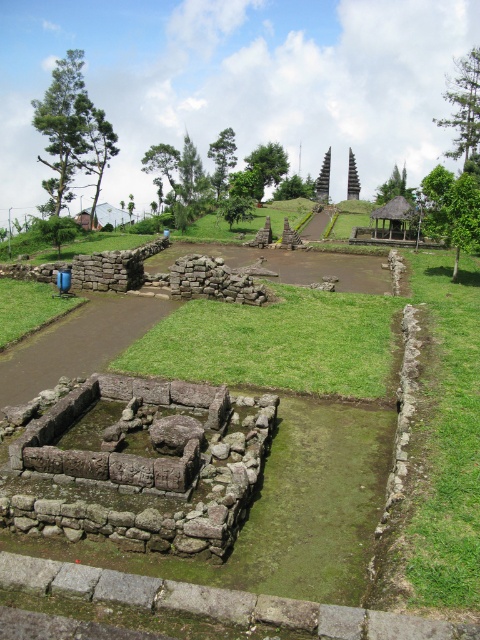
You are an archaeologist examining the site. You see the green mossy stone at center and the green grass at lower left. Which object is positioned to the right of the other?

The green mossy stone at center is to the right of green grass at lower left.

You are standing at the archaeological site and see the point marked at coordinates (294, 524). What object is located at that point?

The point at coordinates (294, 524) corresponds to the green mossy stone at center.